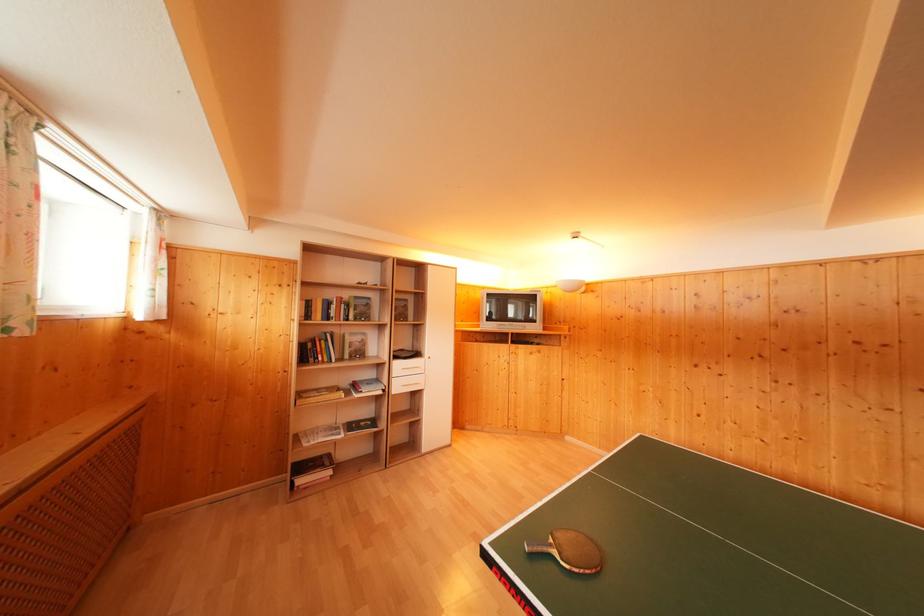
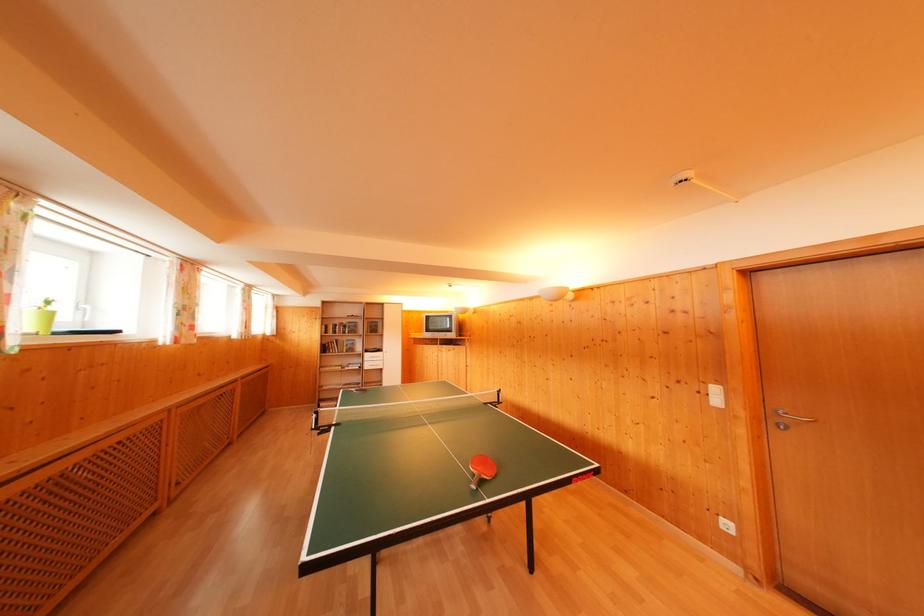
Locate, in the second image, the point that corresponds to the point at 350,300 in the first image.

(349, 326)